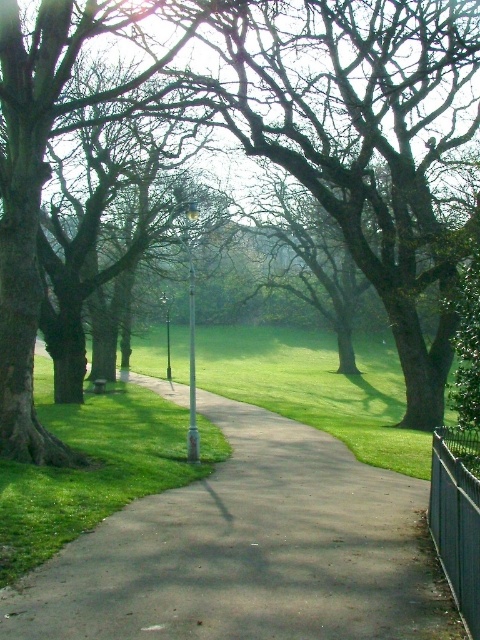
You are a gardener planning to mow the grass near the smooth asphalt path at center and the black metal fence at right. Which object should you avoid mowing near to prevent damaging it?

You should avoid mowing near the black metal fence at right because the smooth asphalt path at center is in front of it, meaning the fence is further back and closer to the mowing area. Wait, actually, according to the description, the path is in front of the fence, so the fence is behind the path. Therefore, the fence is further away from the mowing area near the path. Hmm, maybe I need to clarify. Let me think again. If the path is in front of the fence, then the fence is behind the path. So when mowing,

You are standing at the entrance of the park and want to reach the smooth asphalt path at center. According to the coordinates provided, in which direction should you walk to reach it?

The smooth asphalt path at center is located at coordinates point (249, 552), so you should walk towards the direction of the coordinates to reach it.